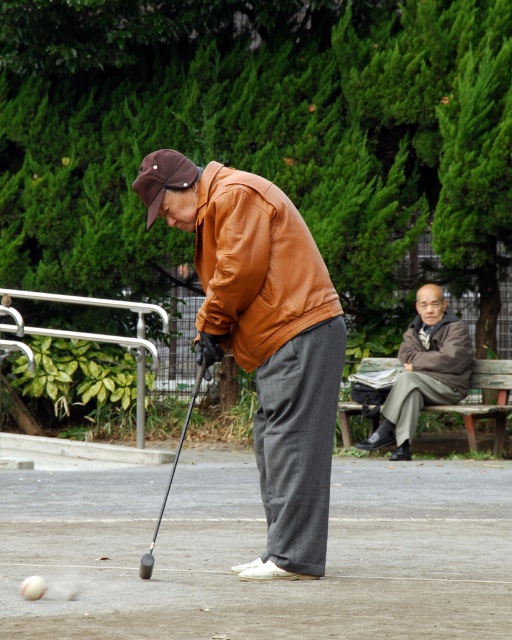
You are a golfer who wants to hit the white matte golf ball at lower left with a club. However, there is a gray fabric jacket at upper right in the way. Can you hit the ball without disturbing the jacket?

The gray fabric jacket at upper right is located above the white matte golf ball at lower left, so you can hit the ball without disturbing the jacket as it is positioned above and not in the direct path of the swing.

You are a delivery robot with a delivery radius of 7 meters. You need to deliver a package from the brown leather jacket at center to the gray fabric jacket at upper right. Can you complete the delivery within your radius?

The distance between the brown leather jacket at center and the gray fabric jacket at upper right is 6.99 meters, which is within the 7 meter radius. Yes, the delivery robot can complete the delivery.

You are a tailor measuring the width of two items for alterations. You have a tape measure and need to determine which item is wider between the brown leather jacket at right and the black rubber golf club at lower center. Which one is wider?

The brown leather jacket at right is wider than the black rubber golf club at lower center according to the description.